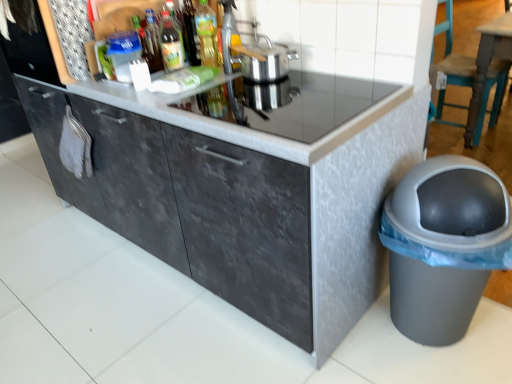
Find the location of `gray plastic trash can at lower right`. gray plastic trash can at lower right is located at coordinates (444, 245).

What is the approximate height of green glass bottle at center, which is counted as the 3th bottle, starting from the left?

It is 8.51 inches.

The image size is (512, 384). What do you see at coordinates (207, 34) in the screenshot? I see `translucent glass bottle at upper center, the 4th bottle viewed from the left` at bounding box center [207, 34].

Describe the element at coordinates (229, 38) in the screenshot. I see `metallic silver pot at upper center` at that location.

What do you see at coordinates (453, 54) in the screenshot? The image size is (512, 384). I see `teal wood chair at right` at bounding box center [453, 54].

The image size is (512, 384). What do you see at coordinates (247, 190) in the screenshot?
I see `dark gray textured cabinet at center` at bounding box center [247, 190].

Image resolution: width=512 pixels, height=384 pixels. Identify the location of translucent glass bottle at upper center, acting as the third bottle starting from the right. (152, 43).

How much distance is there between green glass bottle at center, placed as the second bottle when sorted from right to left, and translucent glass bottle at upper center, the first bottle in the right-to-left sequence?

green glass bottle at center, placed as the second bottle when sorted from right to left, and translucent glass bottle at upper center, the first bottle in the right-to-left sequence, are 13.57 centimeters apart.

From the picture: Between green glass bottle at center, which is counted as the 3th bottle, starting from the left, and translucent glass bottle at upper center, the 4th bottle viewed from the left, which one is positioned behind?

green glass bottle at center, which is counted as the 3th bottle, starting from the left.

Would you say green glass bottle at center, placed as the second bottle when sorted from right to left, is outside translucent glass bottle at upper center, the first bottle in the right-to-left sequence?

Yes, green glass bottle at center, placed as the second bottle when sorted from right to left, is located beyond the bounds of translucent glass bottle at upper center, the first bottle in the right-to-left sequence.

Is green glass bottle at center, placed as the second bottle when sorted from right to left, positioned with its back to translucent glass bottle at upper center, the first bottle in the right-to-left sequence?

No, green glass bottle at center, placed as the second bottle when sorted from right to left, is not facing away from translucent glass bottle at upper center, the first bottle in the right-to-left sequence.

Can you confirm if translucent glass bottle at upper center, which appears as the second bottle when viewed from the left, is thinner than silver metallic pot at upper center?

Correct, the width of translucent glass bottle at upper center, which appears as the second bottle when viewed from the left, is less than that of silver metallic pot at upper center.

In the scene shown: Between translucent glass bottle at upper center, acting as the third bottle starting from the right, and silver metallic pot at upper center, which one has less height?

With less height is silver metallic pot at upper center.

Which object is further away from the camera taking this photo, translucent glass bottle at upper center, which appears as the second bottle when viewed from the left, or silver metallic pot at upper center?

translucent glass bottle at upper center, which appears as the second bottle when viewed from the left, is more distant.

Is point (145, 45) closer or farther from the camera than point (259, 38)?

Point (145, 45) appears to be farther away from the viewer than point (259, 38).

Is dark gray textured cabinet at center oriented towards black glass countertop at center?

No, dark gray textured cabinet at center does not turn towards black glass countertop at center.

Is dark gray textured cabinet at center shorter than black glass countertop at center?

In fact, dark gray textured cabinet at center may be taller than black glass countertop at center.

From the image's perspective, is dark gray textured cabinet at center above or below black glass countertop at center?

Based on their image positions, dark gray textured cabinet at center is located beneath black glass countertop at center.

Considering the positions of objects green glass bottle at center, placed as the second bottle when sorted from right to left, and metallic silver pot at upper center in the image provided, who is more to the right, green glass bottle at center, placed as the second bottle when sorted from right to left, or metallic silver pot at upper center?

metallic silver pot at upper center is more to the right.

From the image's perspective, is green glass bottle at center, which is counted as the 3th bottle, starting from the left, positioned above or below metallic silver pot at upper center?

green glass bottle at center, which is counted as the 3th bottle, starting from the left, is situated lower than metallic silver pot at upper center in the image.

Where is `appliance above the green glass bottle at center, which is counted as the 3th bottle, starting from the left (from a real-world perspective)`? The image size is (512, 384). appliance above the green glass bottle at center, which is counted as the 3th bottle, starting from the left (from a real-world perspective) is located at coordinates (229, 38).

Is silver metallic pot at upper center positioned before gray plastic trash can at lower right?

No, silver metallic pot at upper center is further to the viewer.

Between silver metallic pot at upper center and gray plastic trash can at lower right, which one has smaller size?

Smaller between the two is silver metallic pot at upper center.

From the picture: From a real-world perspective, which object rests below the other?

From a 3D spatial view, gray plastic trash can at lower right is below.

Would you consider silver metallic pot at upper center to be distant from gray plastic trash can at lower right?

No.

Can you confirm if teal wood chair at right is shorter than translucent glass bottle at upper center, which appears as the second bottle when viewed from the left?

In fact, teal wood chair at right may be taller than translucent glass bottle at upper center, which appears as the second bottle when viewed from the left.

How much distance is there between teal wood chair at right and translucent glass bottle at upper center, which appears as the second bottle when viewed from the left?

The distance of teal wood chair at right from translucent glass bottle at upper center, which appears as the second bottle when viewed from the left, is 2.11 meters.

Considering the positions of objects teal wood chair at right and translucent glass bottle at upper center, acting as the third bottle starting from the right, in the image provided, who is more to the left, teal wood chair at right or translucent glass bottle at upper center, acting as the third bottle starting from the right,?

translucent glass bottle at upper center, acting as the third bottle starting from the right, is more to the left.

Is teal wood chair at right not close to translucent glass bottle at upper center, which appears as the second bottle when viewed from the left?

Yes, teal wood chair at right and translucent glass bottle at upper center, which appears as the second bottle when viewed from the left, are quite far apart.

Does gray plastic trash can at lower right touch translucent glass bottle at upper center, the first bottle in the right-to-left sequence?

No, gray plastic trash can at lower right is not in contact with translucent glass bottle at upper center, the first bottle in the right-to-left sequence.

Which object is closer to the camera, gray plastic trash can at lower right or translucent glass bottle at upper center, the 4th bottle viewed from the left?

gray plastic trash can at lower right is closer to the camera.

From a real-world perspective, which is physically below, gray plastic trash can at lower right or translucent glass bottle at upper center, the first bottle in the right-to-left sequence?

gray plastic trash can at lower right.

This screenshot has height=384, width=512. I want to click on the 1st bottle counting from the left side of the translucent glass bottle at upper center, the first bottle in the right-to-left sequence, so click(x=170, y=43).

This screenshot has height=384, width=512. In order to click on kitchen appliance that appears on the right of translucent glass bottle at upper center, acting as the third bottle starting from the right in this screenshot , I will do `click(263, 59)`.

Looking at this image, when comparing their distances from metallic silver pot at upper center, does translucent glass bottle at upper center, the fourth bottle in the right-to-left sequence, or teal wood chair at right seem closer?

translucent glass bottle at upper center, the fourth bottle in the right-to-left sequence, lies closer to metallic silver pot at upper center than the other object.

Based on their spatial positions, is translucent glass bottle at upper center, the 4th bottle viewed from the left, or metallic silver pot at upper center further from translucent glass bottle at upper center, acting as the third bottle starting from the right?

metallic silver pot at upper center lies further to translucent glass bottle at upper center, acting as the third bottle starting from the right, than the other object.

Considering their positions, is silver metallic pot at upper center positioned further to translucent glass bottle at upper center, which appears as the second bottle when viewed from the left, than metallic silver pot at upper center?

silver metallic pot at upper center is positioned further to the anchor translucent glass bottle at upper center, which appears as the second bottle when viewed from the left.

Looking at the image, which one is located closer to green glass bottle at center, which is counted as the 3th bottle, starting from the left, translucent glass bottle at upper center, the first bottle in the right-to-left sequence, or translucent glass bottle at upper center, which is the 1th bottle in left-to-right order?

Based on the image, translucent glass bottle at upper center, which is the 1th bottle in left-to-right order, appears to be nearer to green glass bottle at center, which is counted as the 3th bottle, starting from the left.

When comparing their distances from dark gray textured cabinet at center, does teal wood chair at right or gray plastic trash can at lower right seem further?

teal wood chair at right lies further to dark gray textured cabinet at center than the other object.

From the image, which object appears to be farther from dark gray textured cabinet at center, translucent glass bottle at upper center, which is the 1th bottle in left-to-right order, or teal wood chair at right?

Based on the image, teal wood chair at right appears to be further to dark gray textured cabinet at center.

From the image, which object appears to be nearer to green glass bottle at center, placed as the second bottle when sorted from right to left, silver metallic pot at upper center or translucent glass bottle at upper center, the first bottle in the right-to-left sequence?

translucent glass bottle at upper center, the first bottle in the right-to-left sequence.

When comparing their distances from dark gray textured cabinet at center, does metallic silver pot at upper center or gray plastic trash can at lower right seem further?

The object further to dark gray textured cabinet at center is metallic silver pot at upper center.

Image resolution: width=512 pixels, height=384 pixels. Find the location of `countertop between translucent glass bottle at upper center, which appears as the second bottle when viewed from the left, and gray plastic trash can at lower right, in the horizontal direction`. countertop between translucent glass bottle at upper center, which appears as the second bottle when viewed from the left, and gray plastic trash can at lower right, in the horizontal direction is located at coordinates (269, 104).

Find the location of a particular element. The width and height of the screenshot is (512, 384). countertop between metallic silver pot at upper center and gray plastic trash can at lower right from top to bottom is located at coordinates (269, 104).

What are the coordinates of `bottle between green glass bottle at center, which is counted as the 3th bottle, starting from the left, and teal wood chair at right from left to right` in the screenshot? It's located at click(x=207, y=34).

The width and height of the screenshot is (512, 384). What are the coordinates of `kitchen appliance located between black glass countertop at center and metallic silver pot at upper center in the depth direction` in the screenshot? It's located at (263, 59).